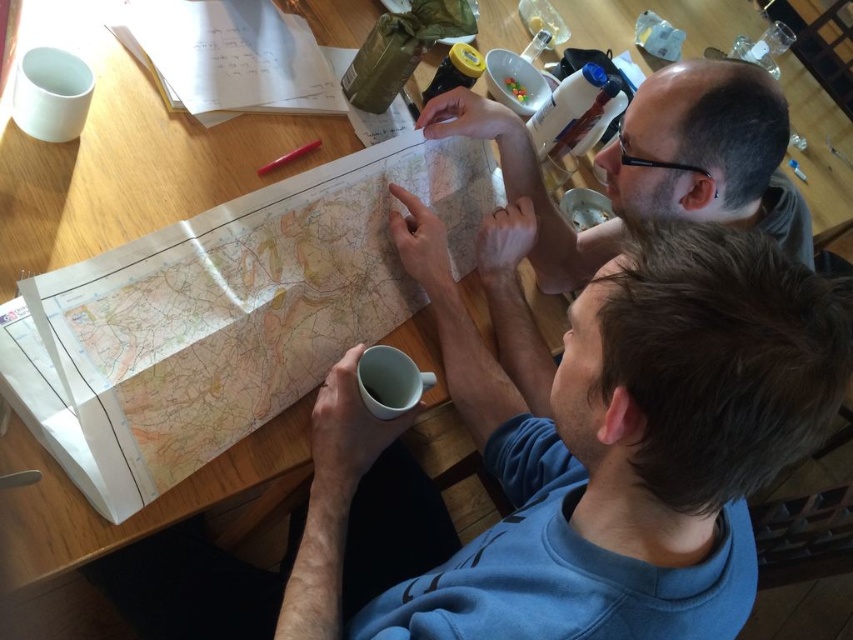
Which is above, blue fleece at center or white matte mug at lower center?

white matte mug at lower center is higher up.

Between point (665, 221) and point (364, 356), which one is positioned behind?

Positioned behind is point (364, 356).

What do you see at coordinates (590, 436) in the screenshot? I see `blue fleece at center` at bounding box center [590, 436].

Identify the location of blue fleece at center. Image resolution: width=853 pixels, height=640 pixels. (590, 436).

Who is more distant from viewer, (292,616) or (120,472)?

The point (120,472) is behind.

Can you confirm if blue fleece at center is positioned above paper map at center?

Actually, blue fleece at center is below paper map at center.

You are a GUI agent. You are given a task and a screenshot of the screen. Output one action in this format:
    pyautogui.click(x=<x>, y=<y>)
    Task: Click on the blue fleece at center
    The height and width of the screenshot is (640, 853).
    Given the screenshot: What is the action you would take?
    pyautogui.click(x=590, y=436)

I want to click on blue fleece at center, so click(590, 436).

Which is more to the right, smooth skin at upper right or white matte mug at lower center?

smooth skin at upper right

Is point (421, 125) positioned before point (397, 413)?

That is False.

Where is `smooth skin at upper right`? smooth skin at upper right is located at coordinates (708, 150).

You are a GUI agent. You are given a task and a screenshot of the screen. Output one action in this format:
    pyautogui.click(x=<x>, y=<y>)
    Task: Click on the smooth skin at upper right
    The width and height of the screenshot is (853, 640).
    Given the screenshot: What is the action you would take?
    pyautogui.click(x=708, y=150)